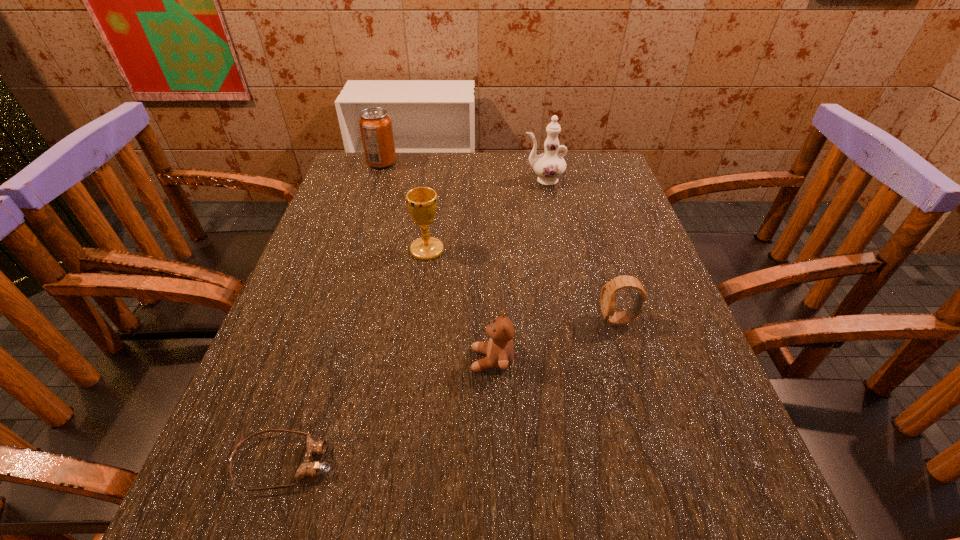
The image size is (960, 540). In order to click on vacant region located on the face of the fourth farthest object in this screenshot , I will do `click(544, 320)`.

Where is `vacant area situated 0.370m on the front lenses and sides of the goggles`? The width and height of the screenshot is (960, 540). vacant area situated 0.370m on the front lenses and sides of the goggles is located at coordinates (580, 462).

Where is `chinaware at the far edge`? Image resolution: width=960 pixels, height=540 pixels. chinaware at the far edge is located at coordinates (550, 165).

In order to click on soda can present at the far edge in this screenshot , I will do `click(375, 124)`.

At what (x,y) coordinates should I click in order to perform the action: click on object located at the near edge. Please return your answer as a coordinate pair (x, y). Looking at the image, I should click on (308, 468).

Image resolution: width=960 pixels, height=540 pixels. Find the location of `soda can at the left edge`. soda can at the left edge is located at coordinates tap(375, 124).

Where is `goggles present at the left edge`? The image size is (960, 540). goggles present at the left edge is located at coordinates (308, 468).

In order to click on chinaware present at the right edge in this screenshot , I will do click(550, 165).

The width and height of the screenshot is (960, 540). Identify the location of watch present at the right edge. (x=607, y=298).

The width and height of the screenshot is (960, 540). Identify the location of object that is at the far left corner. (375, 124).